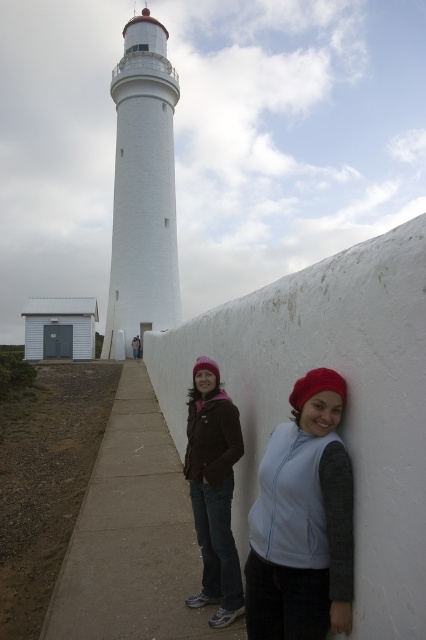
You are a photographer trying to capture both the light blue fleece vest at center and the matte brown jacket at center in a single frame. Since you want to highlight their colors, which clothing item should you position closer to the lighthouse to ensure it doesn not get lost in the background?

The light blue fleece vest at center is shorter than the matte brown jacket at center. Positioning the shorter light blue fleece vest at center closer to the lighthouse will help it stand out against the background better, as its smaller size won t be overwhelmed by the large structure.